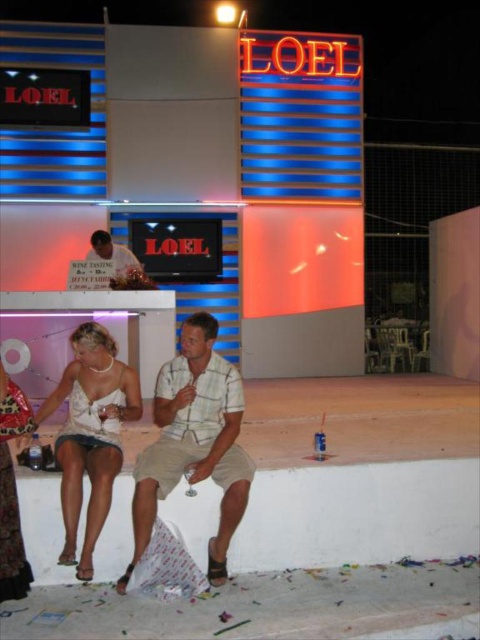
You are a photographer at the LOEL lounge. You want to take a photo of the plaid cotton shirt at center and the matte white dress at center so that both are in focus. Which one should you focus on first to ensure depth of field captures both?

The plaid cotton shirt at center is much taller than the matte white dress at center, so you should focus on the plaid cotton shirt at center first to ensure both are in focus.

You are a fashion designer observing two plaid shirts in the scene at LOEL bar. The plaid cotton shirt at center and the plaid shirt at center. Which one is larger?

The plaid cotton shirt at center is bigger than plaid shirt at center.